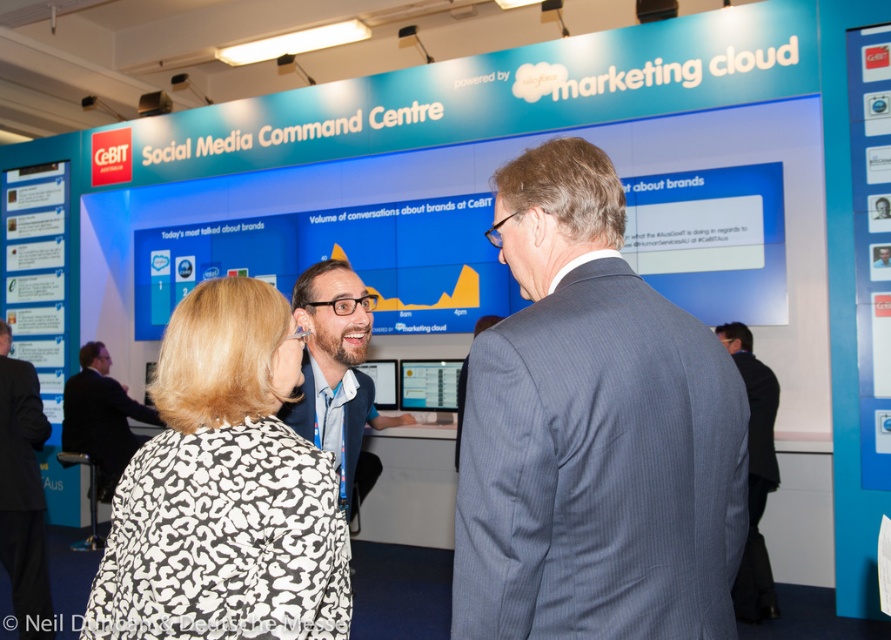
You are a photographer standing at the exhibition booth. You need to take a photo of the matte black suit at center. What is the minimum distance you should stand from the camera to ensure the entire suit fits in the frame?

The minimum distance you should stand from the camera is 1.83 meters to ensure the entire matte black suit at center fits in the frame.

Please describe the position of the matte black suit at center in the image using the coordinate system where the bottom left corner is the origin point. The coordinates are given as a point with values between 0 and 1 for both x and y axes. The x axis increases to the right, and the y axis increases upwards. The coordinates provided are point (333, 365). Please answer with the exact coordinates given in the Objects Description.

The matte black suit at center is located at coordinate point (333, 365).